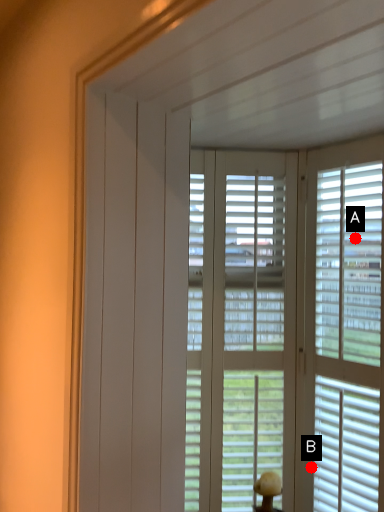
Question: Two points are circled on the image, labeled by A and B beside each circle. Which point is closer to the camera?

Choices:
 (A) A is closer
 (B) B is closer

Answer: (A)